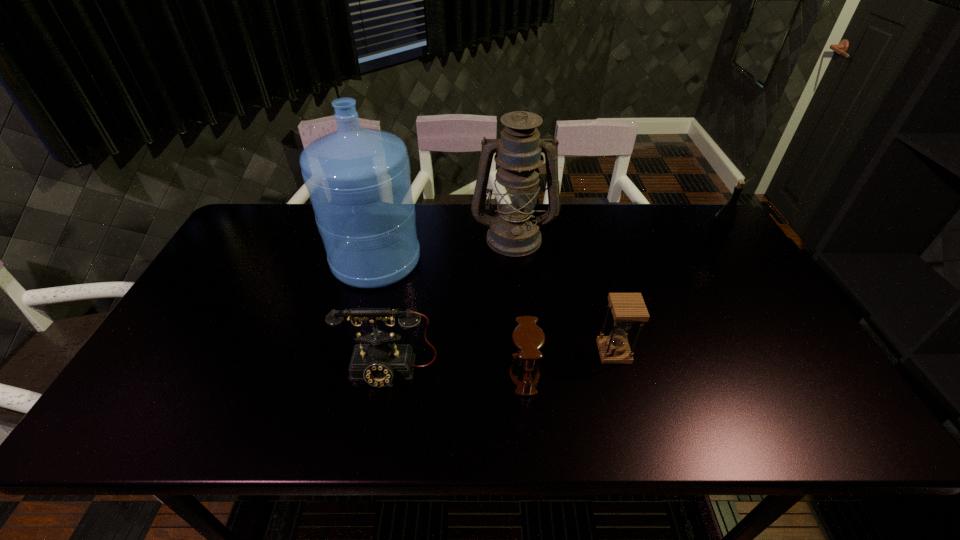
Find the location of a particular element. The image size is (960, 540). vacant space situated on the left of the rightmost object is located at coordinates (584, 247).

Identify the location of free point located on the dial of the telephone. (383, 408).

Locate an element on the screen. The height and width of the screenshot is (540, 960). vacant region located 0.060m on the left of the right hourglass is located at coordinates (575, 352).

Where is `free location located 0.240m on the back of the left hourglass`? The width and height of the screenshot is (960, 540). free location located 0.240m on the back of the left hourglass is located at coordinates (516, 287).

What are the coordinates of `water jug at the far edge` in the screenshot? It's located at point(358,179).

The image size is (960, 540). Find the location of `oil lamp located at the far edge`. oil lamp located at the far edge is located at coordinates (514, 231).

The width and height of the screenshot is (960, 540). I want to click on beer bottle situated at the far edge, so click(723, 222).

Locate an element on the screen. Image resolution: width=960 pixels, height=540 pixels. object positioned at the right edge is located at coordinates (723, 222).

The image size is (960, 540). I want to click on object at the far right corner, so click(723, 222).

In the image, there is a desktop. At what (x,y) coordinates should I click in order to perform the action: click on vacant space at the far edge. Please return your answer as a coordinate pair (x, y). The image size is (960, 540). Looking at the image, I should click on (660, 211).